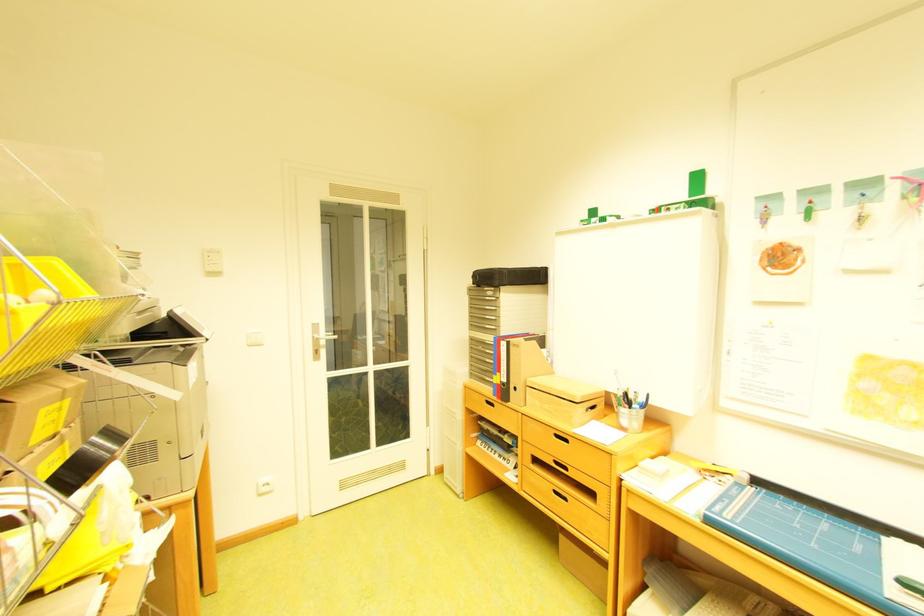
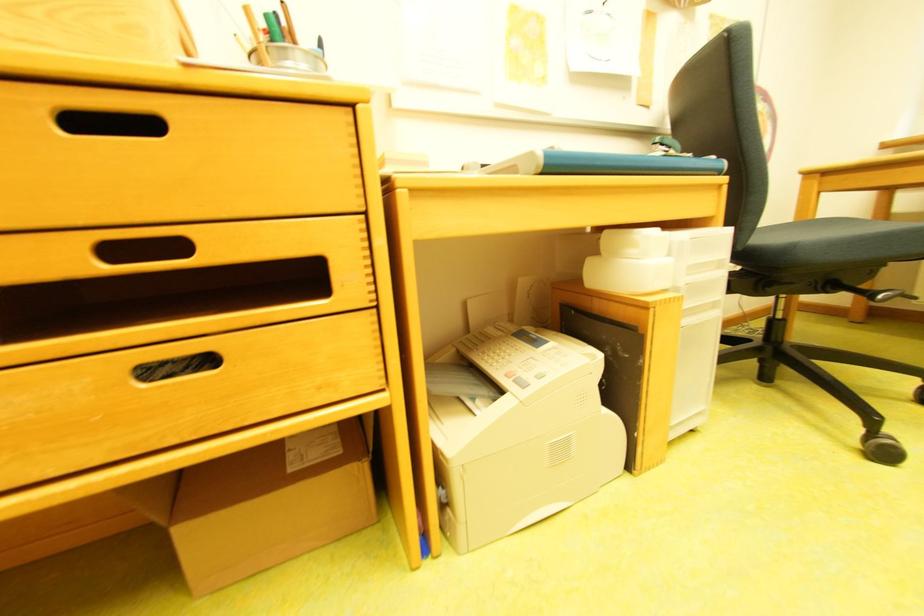
In the second image, find the point that corresponds to the point at 577,469 in the first image.

(189, 246)